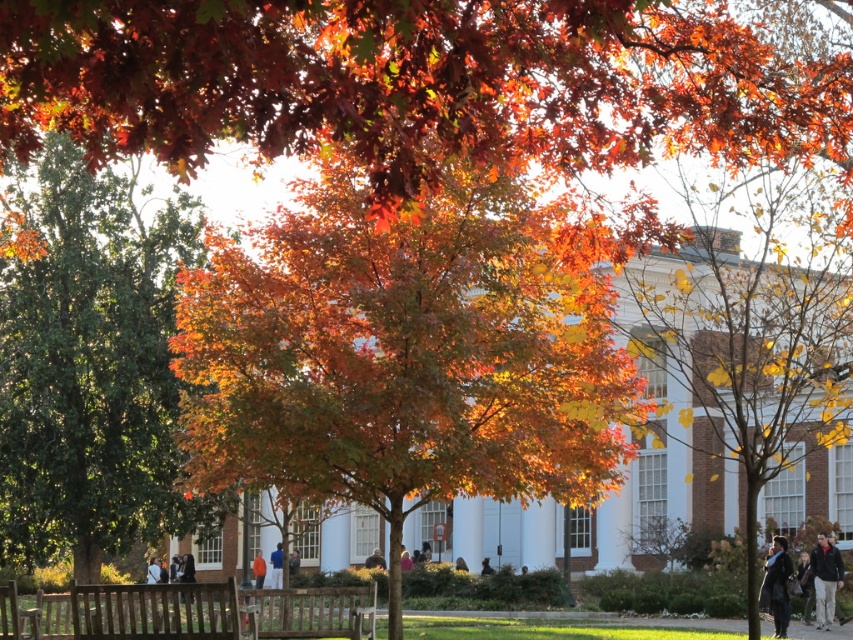
In the scene shown: You are a student sitting on the bench in the foreground of the autumn scene. You notice a shiny green tree at center and a dark gray sweater at lower right. Which object is positioned to the left of the other?

The shiny green tree at center is to the left of the dark gray sweater at lower right.

You are standing at the entrance of the white building and want to find the shiny green tree at center. Based on the scene description, in which direction should you walk to locate it?

The shiny green tree at center is located at the foreground under the shade of trees, so you should walk towards the front area near the entrance to find it.